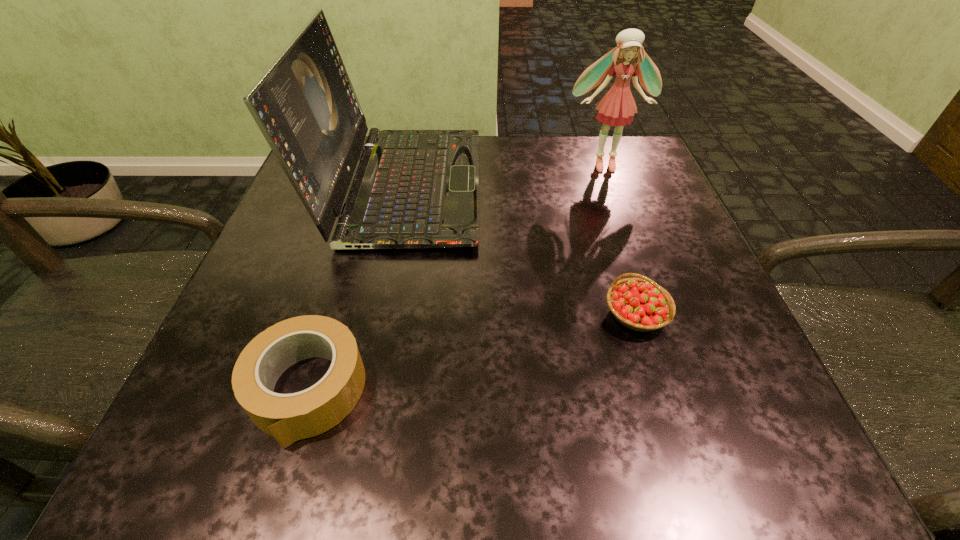
This screenshot has height=540, width=960. I want to click on vacant area at the far right corner, so click(582, 159).

Identify the location of free spot between the shortest object and the laptop computer. The image size is (960, 540). (355, 288).

Locate an element on the screen. free spot between the shortest object and the doll is located at coordinates (455, 277).

This screenshot has height=540, width=960. In order to click on free space between the doll and the strawberry in this screenshot , I will do 620,239.

You are a GUI agent. You are given a task and a screenshot of the screen. Output one action in this format:
    pyautogui.click(x=<x>, y=<y>)
    Task: Click on the free area in between the laptop computer and the doll
    Image resolution: width=960 pixels, height=540 pixels.
    Given the screenshot: What is the action you would take?
    pyautogui.click(x=503, y=176)

Find the location of a particular element. This screenshot has height=540, width=960. vacant area that lies between the laptop computer and the strawberry is located at coordinates (519, 251).

I want to click on free spot between the doll and the shortest object, so click(455, 277).

I want to click on free space between the shortest object and the doll, so click(455, 277).

Identify the location of empty location between the laptop computer and the strawberry. (519, 251).

The width and height of the screenshot is (960, 540). I want to click on free space between the laptop computer and the strawberry, so click(x=519, y=251).